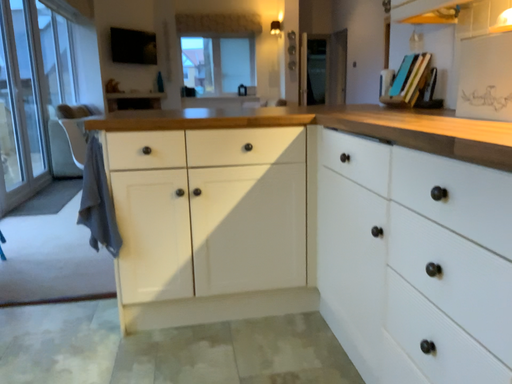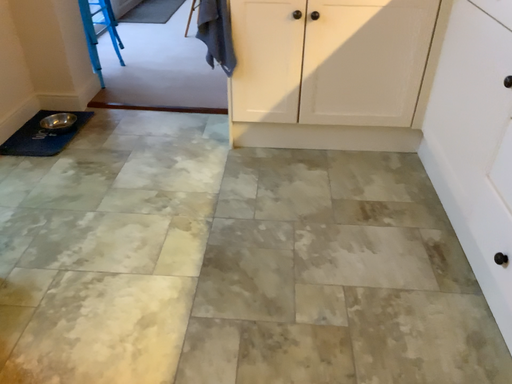
Question: How did the camera likely rotate when shooting the video?

Choices:
 (A) rotated left
 (B) rotated right

Answer: (A)